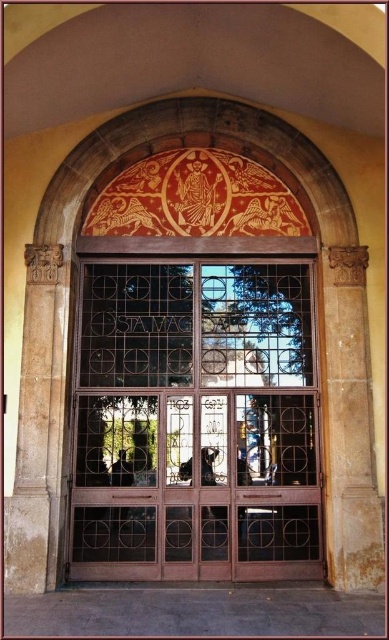
Question: Among these points, which one is nearest to the camera?

Choices:
 (A) (43, 512)
 (B) (217, 214)
 (C) (119, 285)

Answer: (A)

Question: Based on their relative distances, which object is farther from the brown metal window at center?

Choices:
 (A) rustic stone pillar at left
 (B) gold textured tapestry at upper center

Answer: (B)

Question: Is brown metal window at center to the right of rustic stone pillar at left from the viewer's perspective?

Choices:
 (A) no
 (B) yes

Answer: (B)

Question: Is brown metal window at center to the left of rustic stone pillar at left from the viewer's perspective?

Choices:
 (A) yes
 (B) no

Answer: (B)

Question: Among these objects, which one is farthest from the camera?

Choices:
 (A) rustic stone pillar at left
 (B) brown metal window at center

Answer: (B)

Question: Is gold textured tapestry at upper center further to camera compared to rustic stone pillar at left?

Choices:
 (A) no
 (B) yes

Answer: (B)